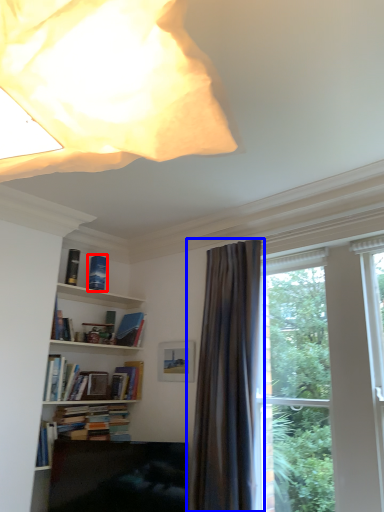
Question: Which object is closer to the camera taking this photo, book (highlighted by a red box) or curtain (highlighted by a blue box)?

Choices:
 (A) book
 (B) curtain

Answer: (B)